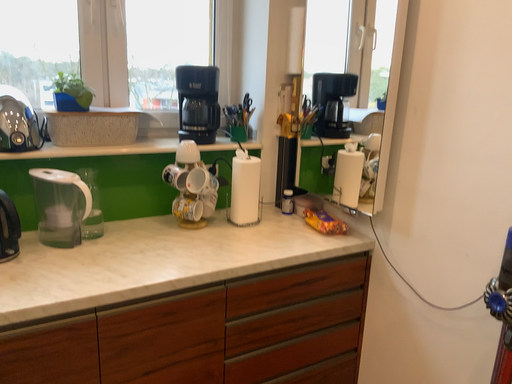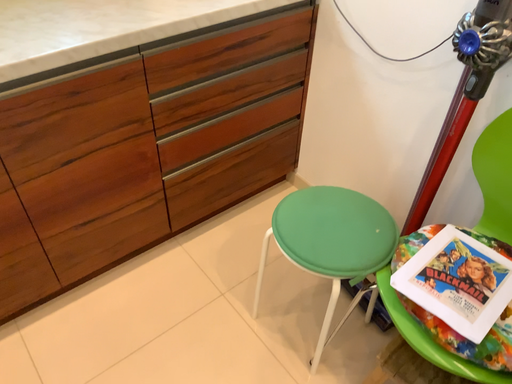
Question: Which way did the camera rotate in the video?

Choices:
 (A) rotated left
 (B) rotated right

Answer: (B)